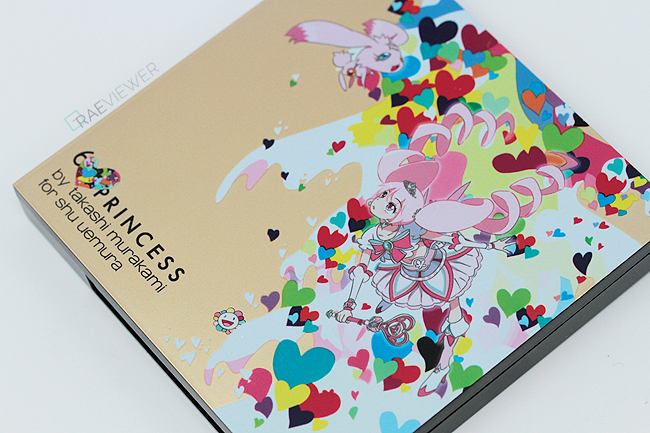
Identify the location of book. (234, 78).